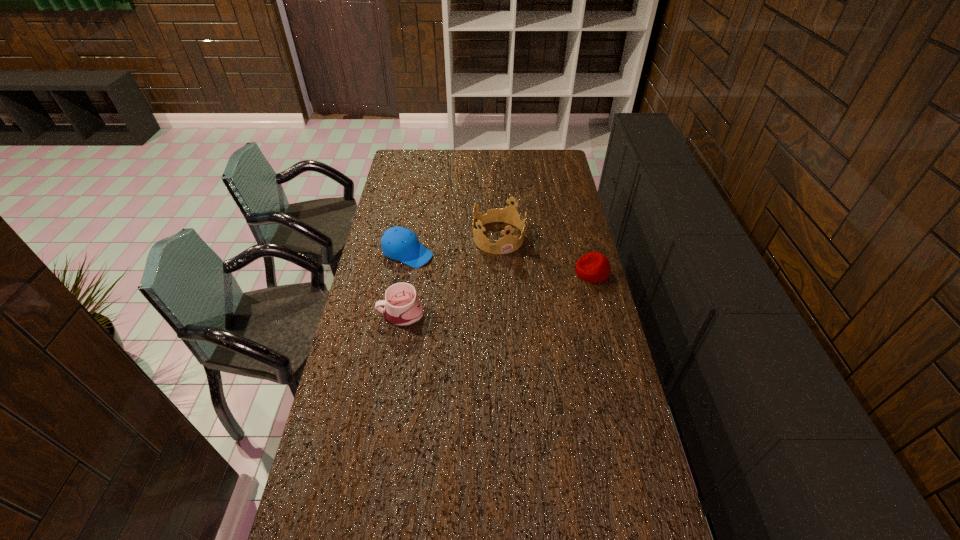
This screenshot has width=960, height=540. I want to click on vacant region at the left edge, so click(x=411, y=226).

In the image, there is a desktop. Where is `vacant area at the right edge`? This screenshot has height=540, width=960. vacant area at the right edge is located at coordinates (573, 257).

This screenshot has height=540, width=960. I want to click on free region at the far left corner of the desktop, so click(402, 155).

Find the location of `free region at the far right corner`. free region at the far right corner is located at coordinates (564, 164).

This screenshot has width=960, height=540. In the image, there is a desktop. What are the coordinates of `vacant space at the near right corner` in the screenshot? It's located at (622, 505).

Where is `vacant area between the nearest object and the tallest object`? vacant area between the nearest object and the tallest object is located at coordinates (449, 275).

Where is `free space between the tiara and the cap`? This screenshot has width=960, height=540. free space between the tiara and the cap is located at coordinates pyautogui.click(x=453, y=245).

I want to click on vacant space in between the cap and the rightmost object, so click(x=500, y=262).

What are the coordinates of `empty location between the rightmost object and the cap` in the screenshot? It's located at (500, 262).

I want to click on free space between the tallest object and the cap, so pyautogui.click(x=453, y=245).